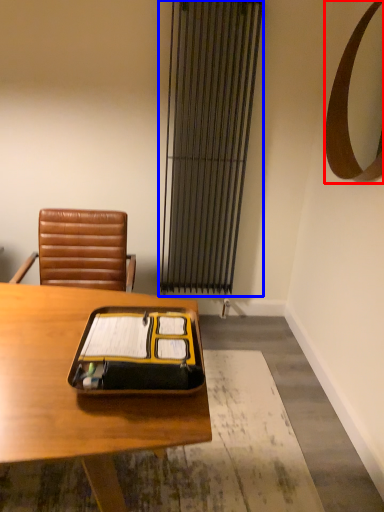
Question: Among these objects, which one is farthest to the camera, mirror (highlighted by a red box) or curtain (highlighted by a blue box)?

Choices:
 (A) mirror
 (B) curtain

Answer: (B)